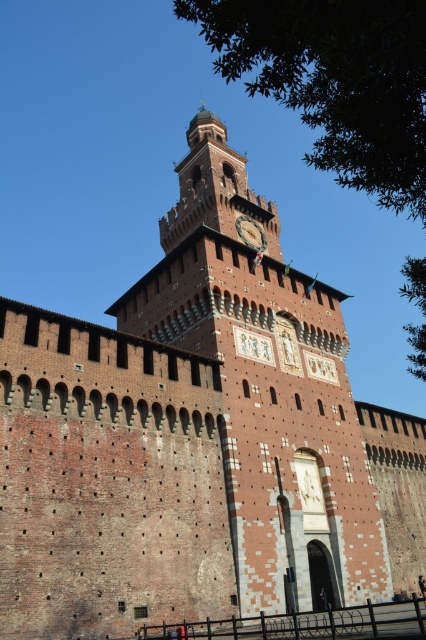
You are an architect examining the historic brick structure. You notice the green leafy tree at upper right and the gold metallic clock at center. Which object is positioned nearer to your viewpoint?

The green leafy tree at upper right is closer to the viewer than the gold metallic clock at center.

You are a tourist standing in front of the historic brick structure. You notice a green leafy tree at upper right and a gold metallic clock at center. Which object is positioned higher in the image?

The green leafy tree at upper right is located above the gold metallic clock at center, so it is positioned higher in the image.

You are an architect examining the historic brick structure. You notice a green leafy tree at upper right and a gold metallic clock at center. Which object is located to the right of the other?

The green leafy tree at upper right is positioned on the right side of gold metallic clock at center.